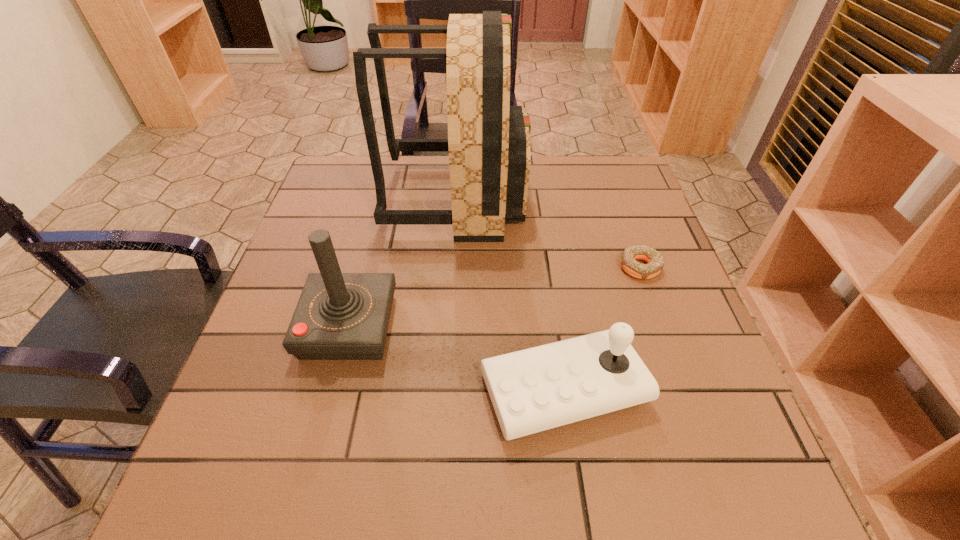
In the image, there is a desktop. At what (x,y) coordinates should I click in order to perform the action: click on free space at the far left corner. Please return your answer as a coordinate pair (x, y). Image resolution: width=960 pixels, height=540 pixels. Looking at the image, I should click on (364, 180).

The width and height of the screenshot is (960, 540). I want to click on vacant space at the far right corner, so click(x=629, y=164).

The width and height of the screenshot is (960, 540). In order to click on blank region between the farthest object and the shorter joystick in this screenshot , I will do `click(510, 294)`.

Where is `unoccupied position between the second shortest object and the tallest object`? unoccupied position between the second shortest object and the tallest object is located at coordinates (510, 294).

Where is `empty location between the doughnut and the second shortest object`? This screenshot has height=540, width=960. empty location between the doughnut and the second shortest object is located at coordinates (602, 328).

In order to click on empty location between the third nearest object and the shorter joystick in this screenshot , I will do `click(602, 328)`.

Where is `unoccupied area between the rightmost object and the farthest object`? unoccupied area between the rightmost object and the farthest object is located at coordinates (548, 233).

This screenshot has height=540, width=960. Find the location of `free space between the doughnut and the taller joystick`. free space between the doughnut and the taller joystick is located at coordinates (494, 297).

This screenshot has height=540, width=960. Identify the location of unoccupied area between the right joystick and the shortest object. (602, 328).

Find the location of a particular element. vacant region between the rightmost object and the left joystick is located at coordinates (494, 297).